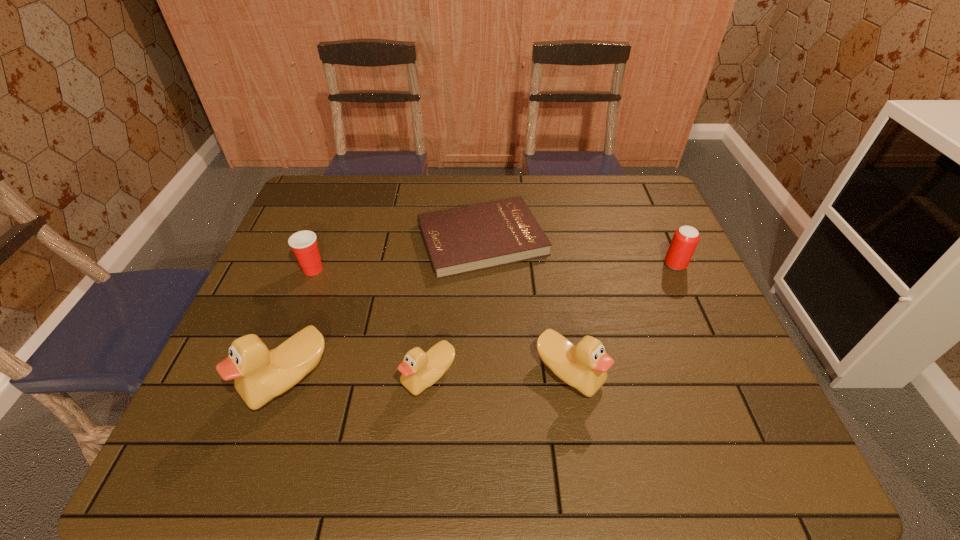
Find the location of `unoccupied area between the second duck from left to right and the rightmost object`. unoccupied area between the second duck from left to right and the rightmost object is located at coordinates (552, 320).

Find the location of a particular element. The width and height of the screenshot is (960, 540). free point between the rightmost object and the second duck from right to left is located at coordinates (552, 320).

In order to click on empty location between the rightmost object and the second shortest duck in this screenshot , I will do `click(622, 319)`.

Locate an element on the screen. The height and width of the screenshot is (540, 960). free spot between the Dixie cup and the shortest duck is located at coordinates (372, 323).

Where is `vacant region between the hardback book and the beer can`? Image resolution: width=960 pixels, height=540 pixels. vacant region between the hardback book and the beer can is located at coordinates (579, 252).

Find the location of a particular element. free area in between the hardback book and the second duck from right to left is located at coordinates click(455, 307).

Identify the location of object that is the second nearest to the shortest object. The height and width of the screenshot is (540, 960). (303, 243).

Identify which object is located as the third nearest to the shortest object. Please provide its 2D coordinates. Your answer should be formatted as a tuple, i.e. [(x, y)], where the tuple contains the x and y coordinates of a point satisfying the conditions above.

[(420, 370)]

Choose which duck is the nearest neighbor to the second duck from right to left. Please provide its 2D coordinates. Your answer should be formatted as a tuple, i.e. [(x, y)], where the tuple contains the x and y coordinates of a point satisfying the conditions above.

[(260, 375)]

This screenshot has width=960, height=540. I want to click on the second closest duck to the second duck from right to left, so click(584, 366).